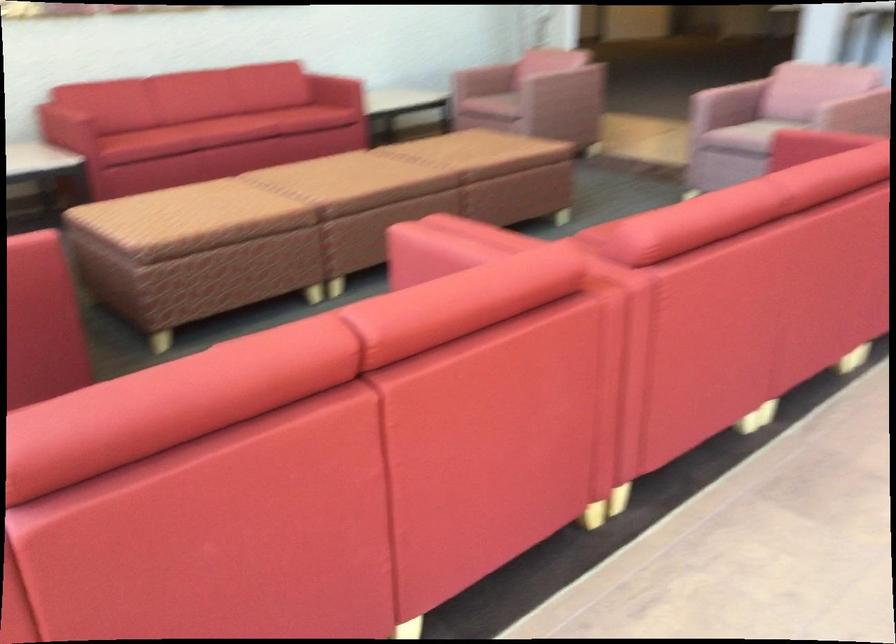
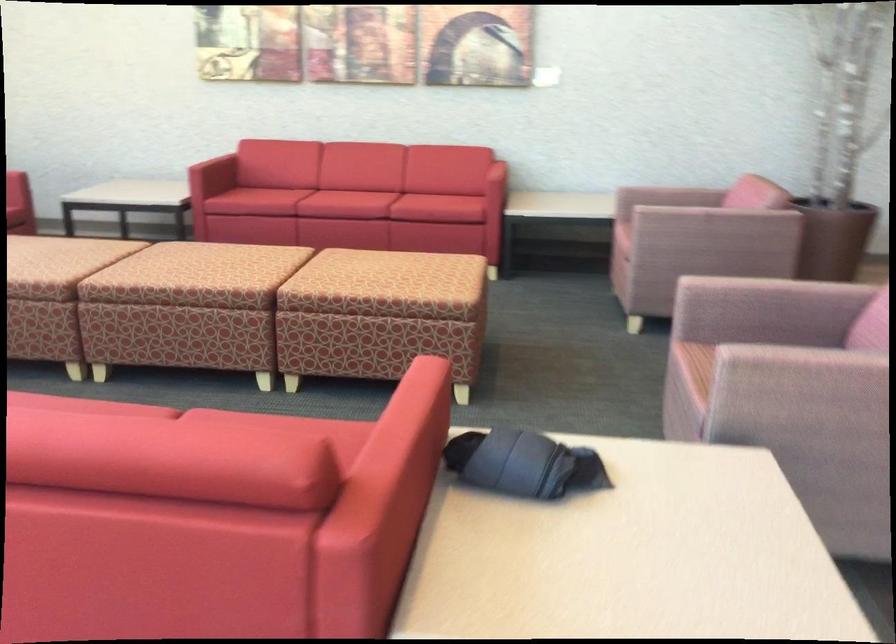
Where in the second image is the point corresponding to [729,120] from the first image?

(760, 330)